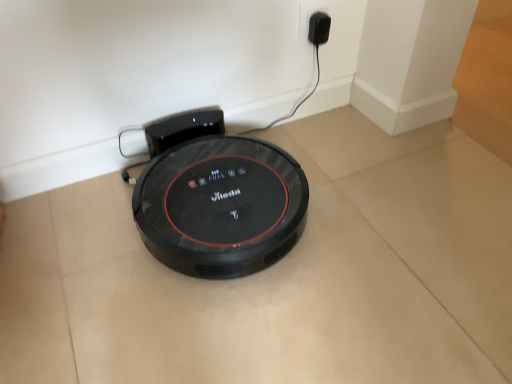
Locate an element on the screen. black plastic robot vacuum cleaner at center is located at coordinates (217, 198).

Describe the element at coordinates (217, 198) in the screenshot. This screenshot has height=384, width=512. I see `black plastic robot vacuum cleaner at center` at that location.

You are a GUI agent. You are given a task and a screenshot of the screen. Output one action in this format:
    pyautogui.click(x=<x>, y=<y>)
    Task: Click on the black plastic robot vacuum cleaner at center
    
    Given the screenshot: What is the action you would take?
    coord(217,198)